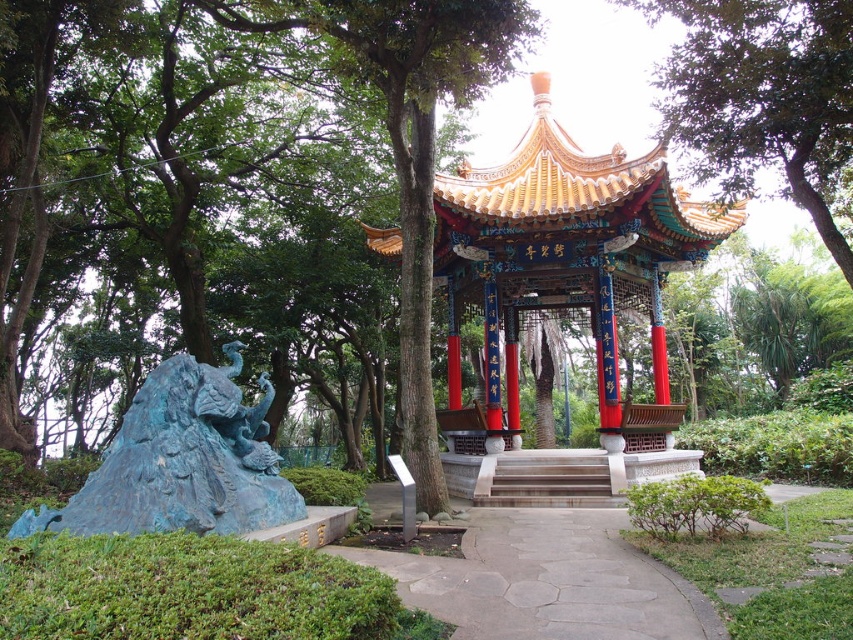
Measure the distance between golden glazed pagoda at center and gray stone path at center.

golden glazed pagoda at center and gray stone path at center are 7.68 meters apart.

Does golden glazed pagoda at center have a greater height compared to gray stone path at center?

Correct, golden glazed pagoda at center is much taller as gray stone path at center.

Find the location of a particular element. golden glazed pagoda at center is located at coordinates (564, 269).

The width and height of the screenshot is (853, 640). I want to click on golden glazed pagoda at center, so tap(564, 269).

Can you confirm if gray stone path at center is positioned above smooth stone stairs at center?

Yes.

Does point (549, 628) come behind point (524, 504)?

No, (549, 628) is closer to viewer.

Locate an element on the screen. gray stone path at center is located at coordinates (547, 580).

The width and height of the screenshot is (853, 640). Identify the location of gray stone path at center. (547, 580).

Between golden glazed pagoda at center and blue patina dragon at lower left, which one has more height?

Standing taller between the two is blue patina dragon at lower left.

Does golden glazed pagoda at center have a lesser width compared to blue patina dragon at lower left?

Yes, golden glazed pagoda at center is thinner than blue patina dragon at lower left.

Is point (584, 180) closer to viewer compared to point (196, 513)?

No, (584, 180) is further to viewer.

This screenshot has width=853, height=640. Find the location of `golden glazed pagoda at center`. golden glazed pagoda at center is located at coordinates (564, 269).